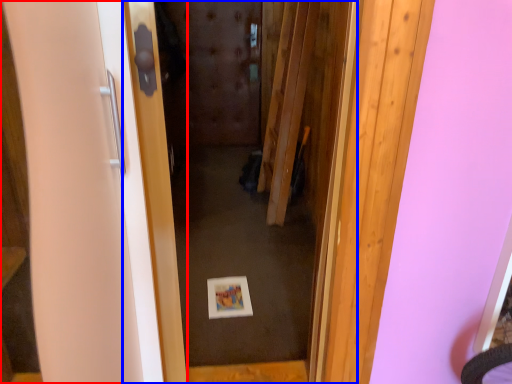
Question: Which point is closer to the camera, door (highlighted by a red box) or door (highlighted by a blue box)?

Choices:
 (A) door
 (B) door

Answer: (A)